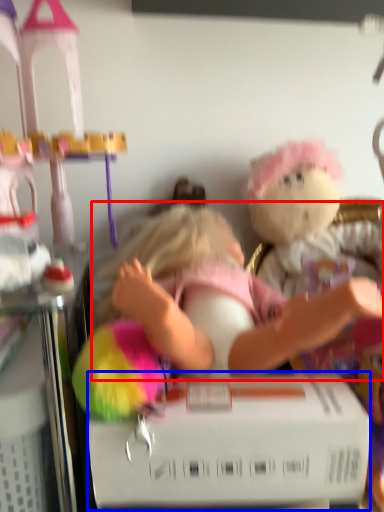
Question: Which of the following is the closest to the observer, person (highlighted by a red box) or box (highlighted by a blue box)?

Choices:
 (A) person
 (B) box

Answer: (B)